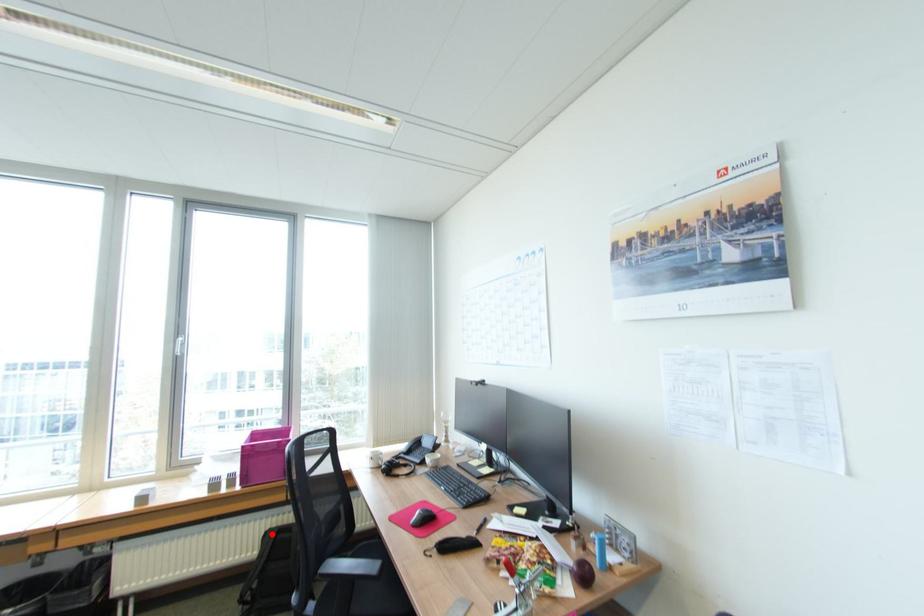
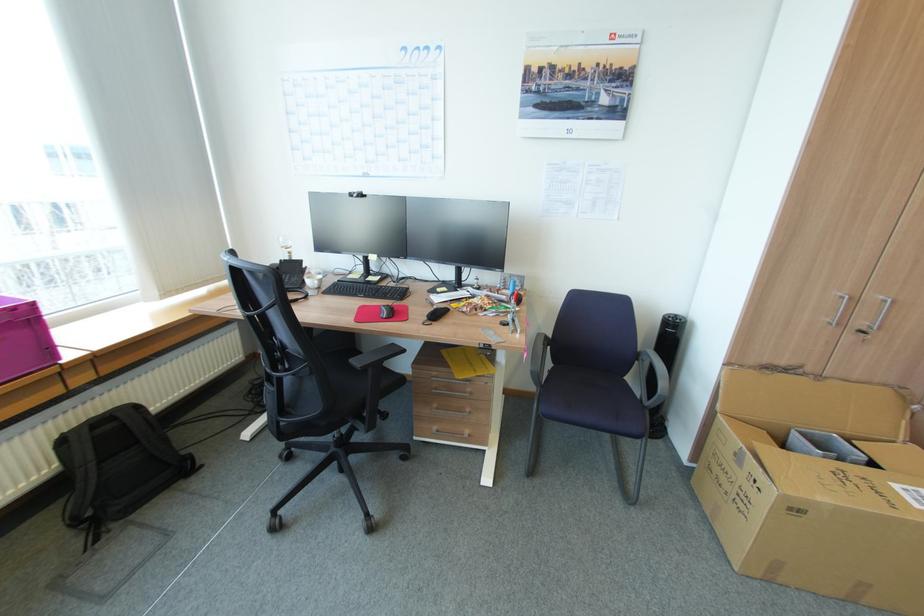
Locate, in the second image, the point that corresponds to the highlighted location in the first image.

(68, 440)